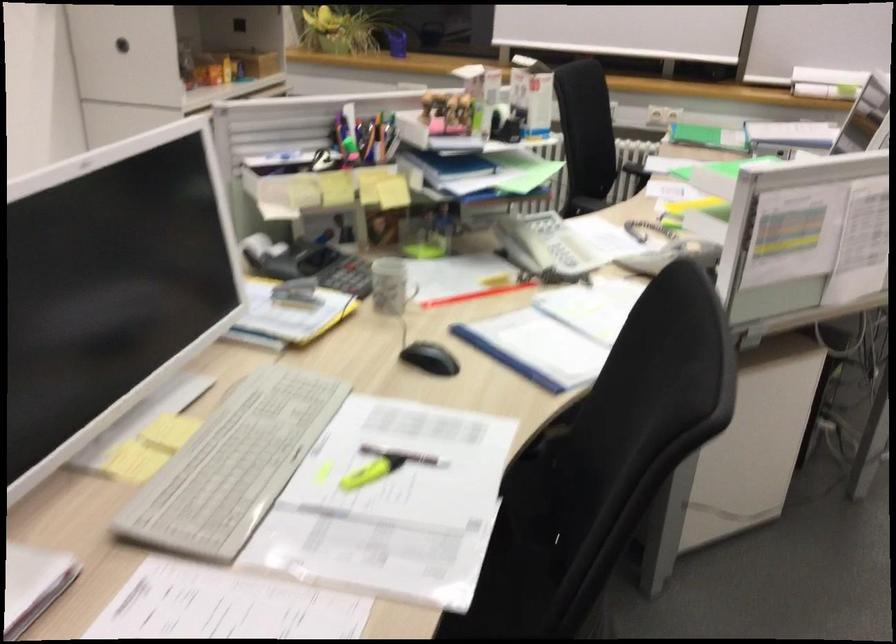
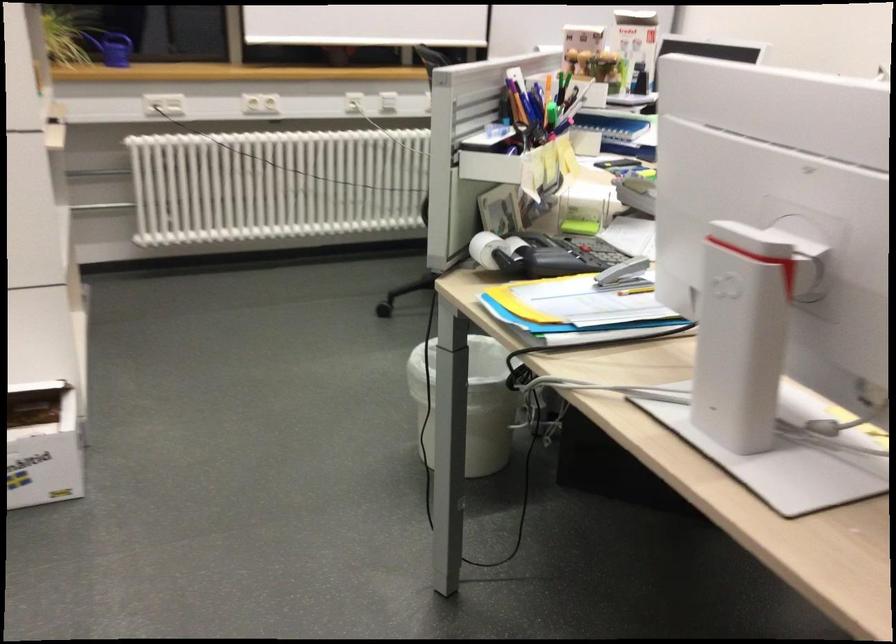
Find the pixel in the second image that matches the point at 382,138 in the first image.

(547, 98)